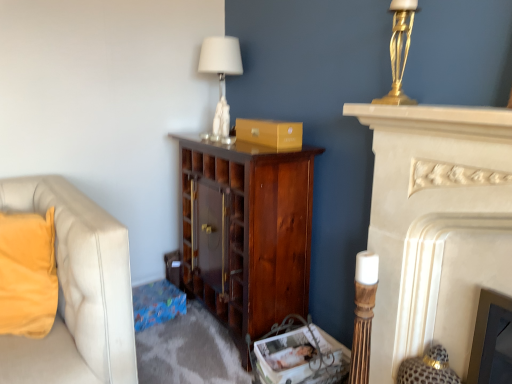
Question: Do you think dark wood cabinet at center is within gold metallic lamp at upper right, or outside of it?

Choices:
 (A) outside
 (B) inside

Answer: (A)

Question: Considering their positions, is dark wood cabinet at center located in front of or behind gold metallic lamp at upper right?

Choices:
 (A) front
 (B) behind

Answer: (B)

Question: Which of these objects is positioned farthest from the matte gold cardboard box at center?

Choices:
 (A) gold metallic lamp at upper right
 (B) white fabric lampshade at upper center
 (C) velvet yellow pillow at left
 (D) dark wood cabinet at center
 (E) white marble fireplace at right

Answer: (C)

Question: Estimate the real-world distances between objects in this image. Which object is closer to the matte gold cardboard box at center?

Choices:
 (A) white marble fireplace at right
 (B) dark wood cabinet at center
 (C) gold metallic lamp at upper right
 (D) white fabric lampshade at upper center
 (E) velvet yellow pillow at left

Answer: (D)